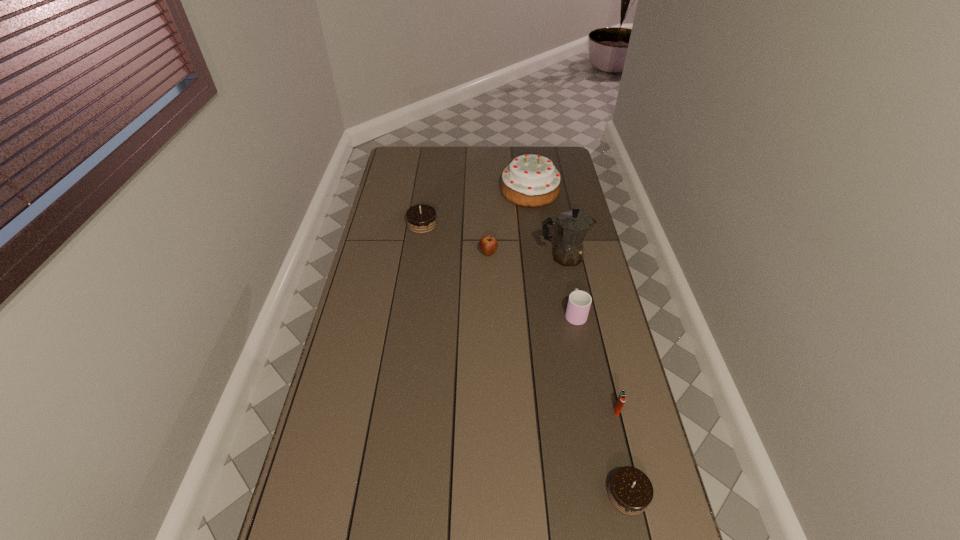
The width and height of the screenshot is (960, 540). I want to click on the farther chocolate cake, so click(x=421, y=219).

The width and height of the screenshot is (960, 540). What are the coordinates of `the left chocolate cake` in the screenshot? It's located at (421, 219).

At what (x,y) coordinates should I click in order to perform the action: click on the nearer chocolate cake. Please return your answer as a coordinate pair (x, y). Looking at the image, I should click on (630, 491).

Image resolution: width=960 pixels, height=540 pixels. In order to click on the right chocolate cake in this screenshot , I will do pos(630,491).

Locate an element on the screen. This screenshot has height=540, width=960. the sixth shortest object is located at coordinates (529, 180).

Where is `the farthest object`? the farthest object is located at coordinates (529, 180).

Where is `the fifth farthest object`? the fifth farthest object is located at coordinates (579, 302).

Where is `the sixth object from right to left`? the sixth object from right to left is located at coordinates (488, 244).

Where is `coffeepot`? The width and height of the screenshot is (960, 540). coffeepot is located at coordinates (572, 226).

The image size is (960, 540). I want to click on igniter, so click(x=621, y=399).